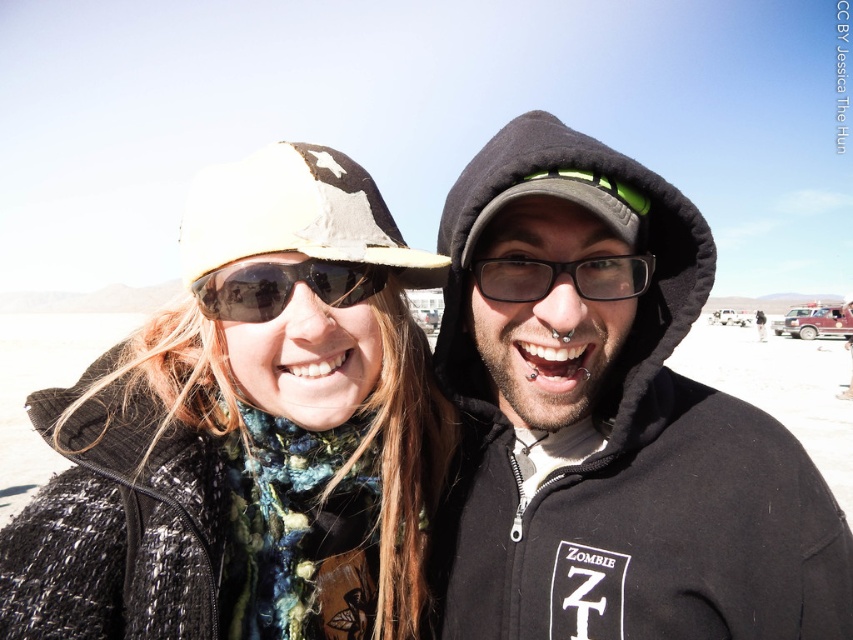
Question: Can you confirm if black hoodie at center is bigger than knitted scarf at center?

Choices:
 (A) no
 (B) yes

Answer: (B)

Question: Which is nearer to the black plastic glasses at center?

Choices:
 (A) black hoodie at center
 (B) knitted scarf at center

Answer: (A)

Question: Which object is farther from the camera taking this photo?

Choices:
 (A) knitted scarf at center
 (B) black hoodie at center
 (C) black plastic glasses at center
 (D) sunglasses at center

Answer: (C)

Question: Is black hoodie at center to the left of sunglasses at center from the viewer's perspective?

Choices:
 (A) no
 (B) yes

Answer: (A)

Question: Which point appears farthest from the camera in this image?

Choices:
 (A) (444, 541)
 (B) (260, 308)
 (C) (276, 595)
 (D) (544, 269)

Answer: (A)

Question: Is black hoodie at center below black plastic glasses at center?

Choices:
 (A) no
 (B) yes

Answer: (B)